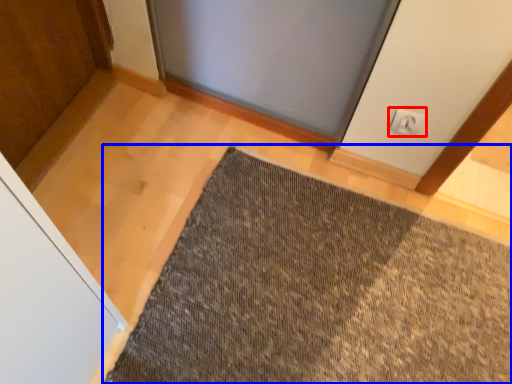
Question: Among these objects, which one is farthest to the camera, electric outlet (highlighted by a red box) or mat (highlighted by a blue box)?

Choices:
 (A) electric outlet
 (B) mat

Answer: (A)